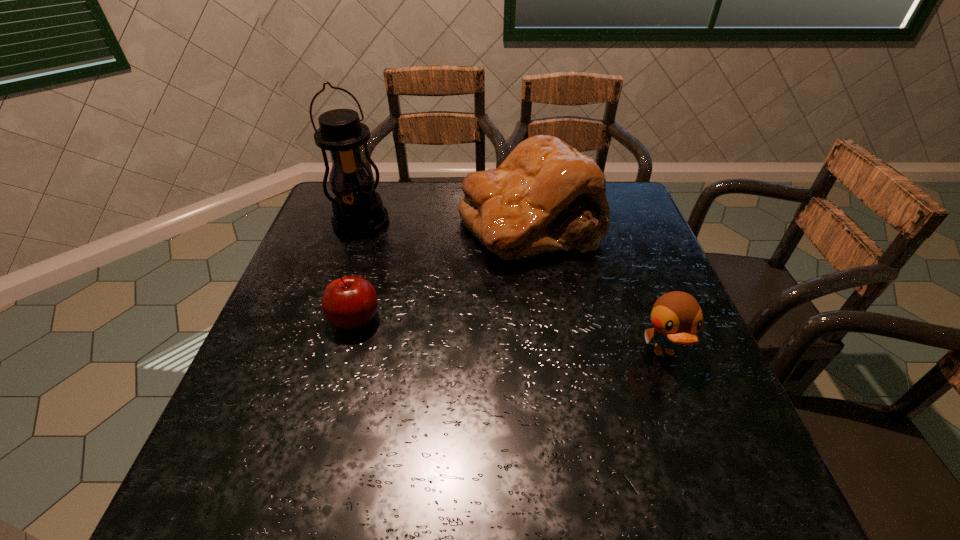
In order to click on vacant space that's between the duck and the tallest object in this screenshot , I will do `click(513, 287)`.

This screenshot has height=540, width=960. I want to click on vacant area that lies between the shortest object and the third tallest object, so click(510, 336).

The image size is (960, 540). Identify the location of unoccupied position between the apple and the bread. coord(443,272).

The height and width of the screenshot is (540, 960). I want to click on free space between the bread and the lantern, so click(x=445, y=222).

The image size is (960, 540). I want to click on vacant point located between the apple and the bread, so click(443, 272).

At what (x,y) coordinates should I click in order to perform the action: click on free space that is in between the duck and the apple. Please return your answer as a coordinate pair (x, y). The height and width of the screenshot is (540, 960). Looking at the image, I should click on (510, 336).

Locate which object is the third closest to the tallest object. Please provide its 2D coordinates. Your answer should be formatted as a tuple, i.e. [(x, y)], where the tuple contains the x and y coordinates of a point satisfying the conditions above.

[(676, 316)]

Locate an element on the screen. The width and height of the screenshot is (960, 540). object that is the third closest to the apple is located at coordinates (676, 316).

Identify the location of vacant space that satisfies the following two spatial constraints: 1. on the back side of the shortest object; 2. on the right side of the third shortest object. (381, 224).

Identify the location of vacant space that satisfies the following two spatial constraints: 1. on the front side of the lantern; 2. on the right side of the third shortest object. This screenshot has height=540, width=960. (360, 224).